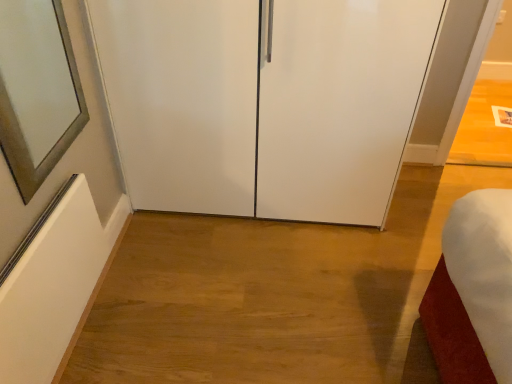
Question: Relative to satin silver mirror at left, is transparent glass cabinet at center in front or behind?

Choices:
 (A) front
 (B) behind

Answer: (B)

Question: Does point (201, 147) appear closer or farther from the camera than point (0, 31)?

Choices:
 (A) farther
 (B) closer

Answer: (A)

Question: From the image's perspective, is transparent glass cabinet at center above or below satin silver mirror at left?

Choices:
 (A) above
 (B) below

Answer: (A)

Question: Is satin silver mirror at left bigger or smaller than transparent glass cabinet at center?

Choices:
 (A) big
 (B) small

Answer: (B)

Question: Would you say satin silver mirror at left is inside or outside transparent glass cabinet at center?

Choices:
 (A) inside
 (B) outside

Answer: (B)

Question: From the image's perspective, is satin silver mirror at left located above or below transparent glass cabinet at center?

Choices:
 (A) below
 (B) above

Answer: (A)

Question: Considering the relative positions of satin silver mirror at left and transparent glass cabinet at center in the image provided, is satin silver mirror at left to the left or to the right of transparent glass cabinet at center?

Choices:
 (A) left
 (B) right

Answer: (A)